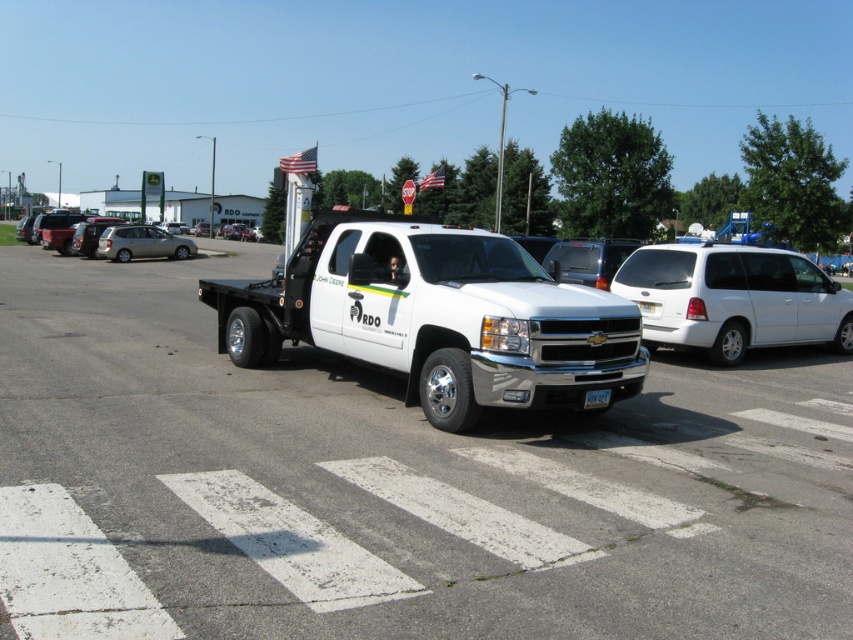
Is white glossy truck at center positioned before white plastic license plate at center?

Yes.

Which is in front, point (190, 356) or point (585, 404)?

Point (585, 404) is more forward.

The image size is (853, 640). I want to click on white glossy truck at center, so click(x=392, y=486).

Who is taller, silver metallic sedan at center or white plastic license plate at center?

silver metallic sedan at center

The height and width of the screenshot is (640, 853). I want to click on silver metallic sedan at center, so (x=57, y=228).

Locate an element on the screen. The image size is (853, 640). satin silver sedan at left is located at coordinates (141, 243).

Can you confirm if satin silver sedan at left is thinner than white plastic license plate at center?

No, satin silver sedan at left is not thinner than white plastic license plate at center.

Is point (178, 237) farther from viewer compared to point (607, 403)?

That is True.

Locate an element on the screen. The height and width of the screenshot is (640, 853). satin silver sedan at left is located at coordinates (141, 243).